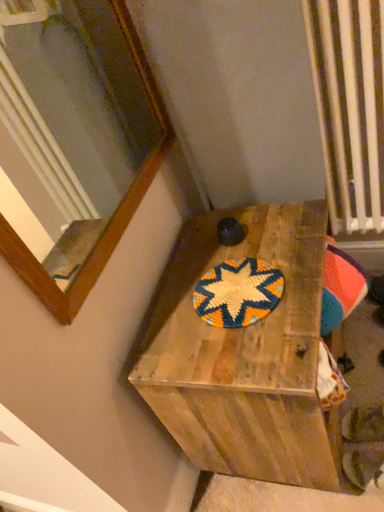
Question: Is wooden box at center positioned with its back to brightly woven mat at center?

Choices:
 (A) yes
 (B) no

Answer: (B)

Question: From a real-world perspective, is wooden box at center positioned under brightly woven mat at center based on gravity?

Choices:
 (A) no
 (B) yes

Answer: (B)

Question: Is wooden box at center to the left of brightly woven mat at center from the viewer's perspective?

Choices:
 (A) yes
 (B) no

Answer: (B)

Question: Does wooden box at center have a larger size compared to brightly woven mat at center?

Choices:
 (A) no
 (B) yes

Answer: (B)

Question: Is wooden box at center in contact with brightly woven mat at center?

Choices:
 (A) no
 (B) yes

Answer: (A)

Question: Relative to wooden frame at upper left, is brightly woven mat at center in front or behind?

Choices:
 (A) front
 (B) behind

Answer: (B)

Question: From a real-world perspective, relative to wooden frame at upper left, is brightly woven mat at center vertically above or below?

Choices:
 (A) below
 (B) above

Answer: (A)

Question: From the image's perspective, relative to wooden frame at upper left, is brightly woven mat at center above or below?

Choices:
 (A) above
 (B) below

Answer: (B)

Question: Which is correct: brightly woven mat at center is inside wooden frame at upper left, or outside of it?

Choices:
 (A) outside
 (B) inside

Answer: (A)

Question: Is wooden frame at upper left wider or thinner than wooden box at center?

Choices:
 (A) wide
 (B) thin

Answer: (B)

Question: From a real-world perspective, relative to wooden box at center, is wooden frame at upper left vertically above or below?

Choices:
 (A) above
 (B) below

Answer: (A)

Question: In the image, is wooden frame at upper left positioned in front of or behind wooden box at center?

Choices:
 (A) front
 (B) behind

Answer: (A)

Question: Would you say wooden frame at upper left is to the left or to the right of wooden box at center in the picture?

Choices:
 (A) right
 (B) left

Answer: (B)

Question: From a real-world perspective, is wooden box at center above or below wooden frame at upper left?

Choices:
 (A) below
 (B) above

Answer: (A)

Question: Is wooden box at center spatially inside wooden frame at upper left, or outside of it?

Choices:
 (A) inside
 (B) outside

Answer: (B)